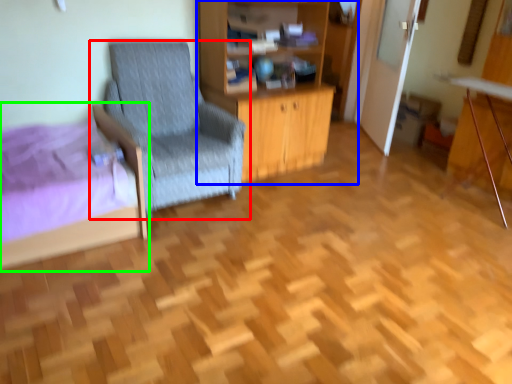
Question: Which is farther away from chair (highlighted by a red box)? dresser (highlighted by a blue box) or bed (highlighted by a green box)?

Choices:
 (A) dresser
 (B) bed

Answer: (B)